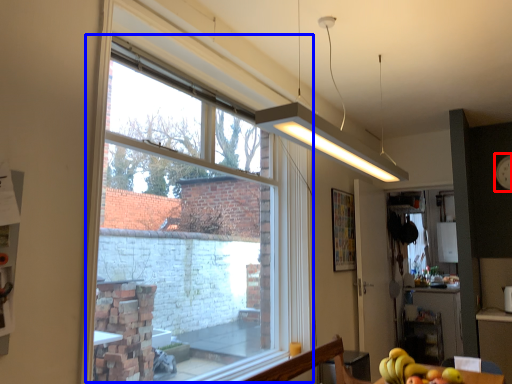
Question: Among these objects, which one is farthest to the camera, clock (highlighted by a red box) or window (highlighted by a blue box)?

Choices:
 (A) clock
 (B) window

Answer: (A)